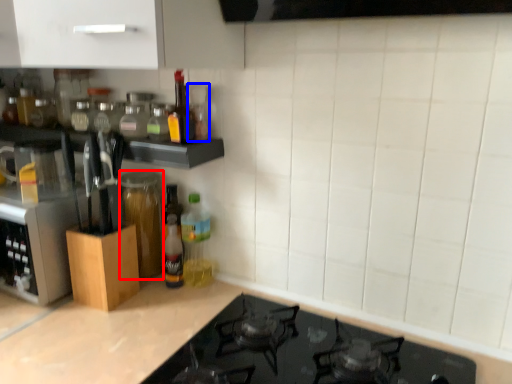
Question: Which of the following is the closest to the observer, glass jar (highlighted by a red box) or bottle (highlighted by a blue box)?

Choices:
 (A) glass jar
 (B) bottle

Answer: (B)